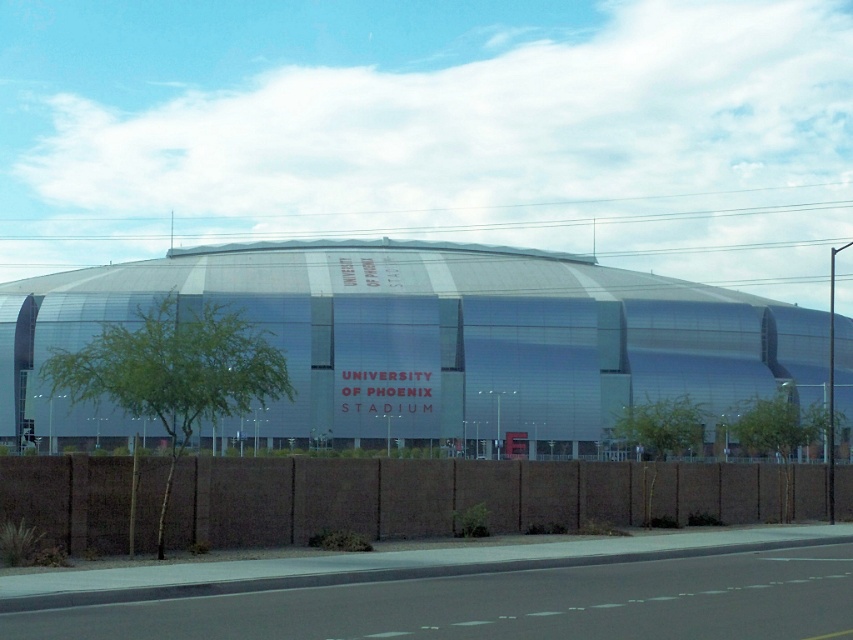
You are a photographer planning to capture the metallic silver stadium at center and the brown textured fence at lower center in a single shot. Based on their sizes, which object should you focus on to ensure both are visible without cropping?

→ The metallic silver stadium at center is wider than the brown textured fence at lower center, so focusing on the metallic silver stadium at center will ensure both objects are visible in the frame.